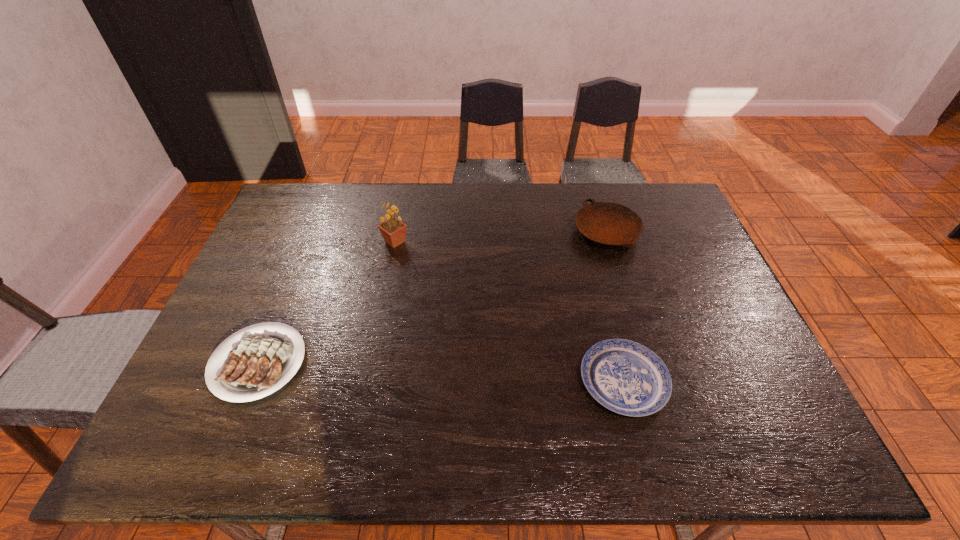
This screenshot has width=960, height=540. In order to click on the second object from left to right in this screenshot , I will do `click(393, 230)`.

In order to click on the tallest object in this screenshot , I will do `click(393, 230)`.

I want to click on the third shortest object, so click(607, 223).

In order to click on the tallest plate in this screenshot , I will do `click(607, 223)`.

I want to click on the leftmost object, so click(x=253, y=367).

Identify the location of free location located 0.130m at the front of the second object from left to right with flowers visible. (449, 242).

This screenshot has width=960, height=540. In order to click on free space located on the left of the farthest plate in this screenshot , I will do `click(540, 232)`.

The width and height of the screenshot is (960, 540). In order to click on vacant space located on the right of the leftmost object in this screenshot , I will do `click(393, 363)`.

Identify the location of object at the far edge. The width and height of the screenshot is (960, 540). (607, 223).

What are the coordinates of `object that is at the near edge` in the screenshot? It's located at (624, 376).